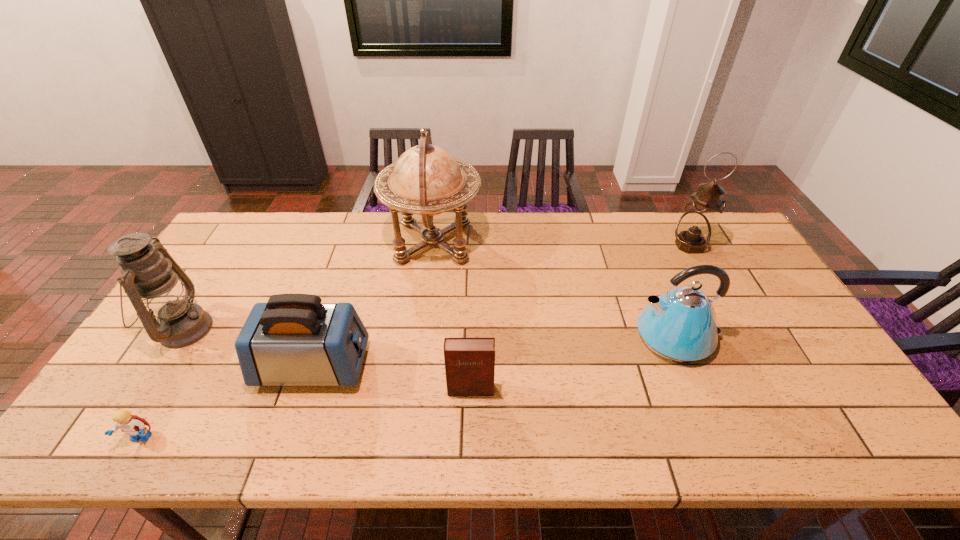
At what (x,y) coordinates should I click in order to perform the action: click on free space that satisfies the following two spatial constraints: 1. at the spout of the kettle; 2. on the front-facing side of the Lego. Please return your answer as a coordinate pair (x, y). The image size is (960, 540). Looking at the image, I should click on (719, 438).

Where is `free region that satisfies the following two spatial constraints: 1. on the front-facing side of the globe; 2. on the front-facing side of the shortest object`? free region that satisfies the following two spatial constraints: 1. on the front-facing side of the globe; 2. on the front-facing side of the shortest object is located at coordinates (408, 438).

The height and width of the screenshot is (540, 960). Identify the location of vacant position in the image that satisfies the following two spatial constraints: 1. on the front-facing side of the globe; 2. on the front-facing side of the shortest object. (408, 438).

Locate an element on the screen. The width and height of the screenshot is (960, 540). free location that satisfies the following two spatial constraints: 1. on the front-facing side of the toaster; 2. on the front-facing side of the shortest object is located at coordinates (289, 438).

The width and height of the screenshot is (960, 540). Find the location of `vacant point that satisfies the following two spatial constraints: 1. at the spout of the kettle; 2. on the front-facing side of the Lego`. vacant point that satisfies the following two spatial constraints: 1. at the spout of the kettle; 2. on the front-facing side of the Lego is located at coordinates (719, 438).